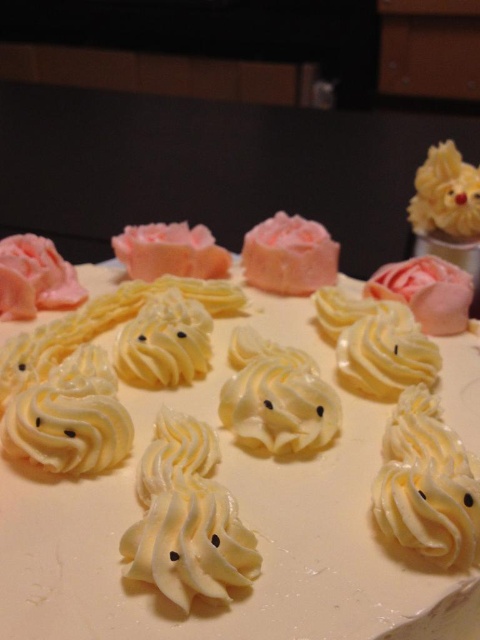
Question: Which of the following is the farthest from the observer?

Choices:
 (A) pink frosted cake at center
 (B) white cream meringues at center

Answer: (A)

Question: Does white cream meringues at center have a larger size compared to pink frosted cake at center?

Choices:
 (A) yes
 (B) no

Answer: (A)

Question: Observing the image, what is the correct spatial positioning of white cream meringues at center in reference to pink frosted cake at center?

Choices:
 (A) below
 (B) above

Answer: (A)

Question: Can you confirm if white cream meringues at center is wider than pink frosted cake at center?

Choices:
 (A) no
 (B) yes

Answer: (B)

Question: Among these points, which one is farthest from the camera?

Choices:
 (A) (313, 525)
 (B) (297, 220)

Answer: (B)